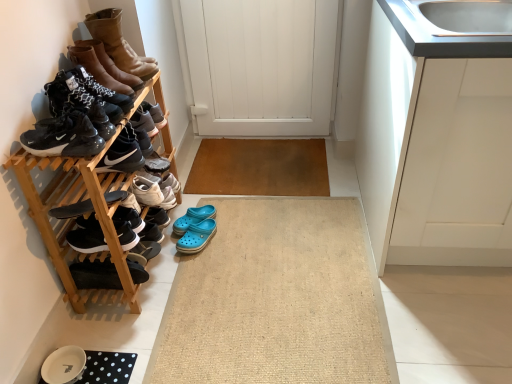
The width and height of the screenshot is (512, 384). In order to click on vacant region below white wooden door at center (from a real-world perspective) in this screenshot , I will do `click(262, 131)`.